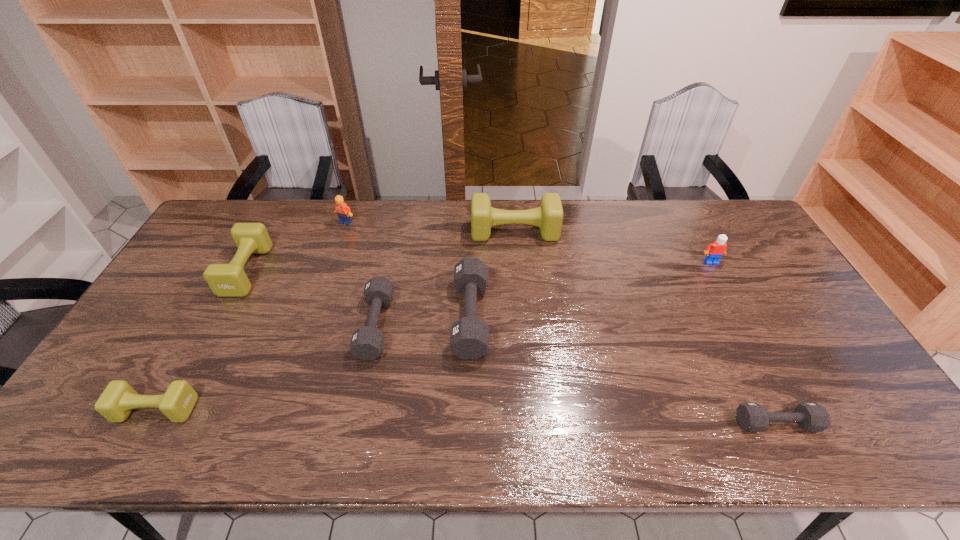
Locate an element on the screen. empty location between the nearest olive dumbbell and the second nearest olive dumbbell is located at coordinates (202, 340).

Locate an element on the screen. vacant area that lies between the tallest dumbbell and the biggest gray dumbbell is located at coordinates (492, 274).

Find the location of a particular element. vacant region between the second biggest gray dumbbell and the shortest object is located at coordinates (576, 374).

Image resolution: width=960 pixels, height=540 pixels. In order to click on free spot between the nearer Lego and the leftmost gray dumbbell in this screenshot , I will do [543, 294].

Where is `free space between the fourth object from left to right and the shortest object`? The height and width of the screenshot is (540, 960). free space between the fourth object from left to right and the shortest object is located at coordinates coord(576,374).

The height and width of the screenshot is (540, 960). I want to click on free space between the biggest gray dumbbell and the farthest dumbbell, so click(x=492, y=274).

The width and height of the screenshot is (960, 540). I want to click on vacant region between the biggest gray dumbbell and the biggest olive dumbbell, so click(492, 274).

The width and height of the screenshot is (960, 540). Identify the location of vacant space that is in between the shortest object and the second gray dumbbell from left to right. (623, 370).

Find the location of a particular element. This screenshot has width=960, height=540. object that can be found as the third closest to the left Lego is located at coordinates (548, 217).

Choose which object is the third nearest neighbor to the fourth object from left to right. Please provide its 2D coordinates. Your answer should be formatted as a tuple, i.e. [(x, y)], where the tuple contains the x and y coordinates of a point satisfying the conditions above.

[(343, 211)]